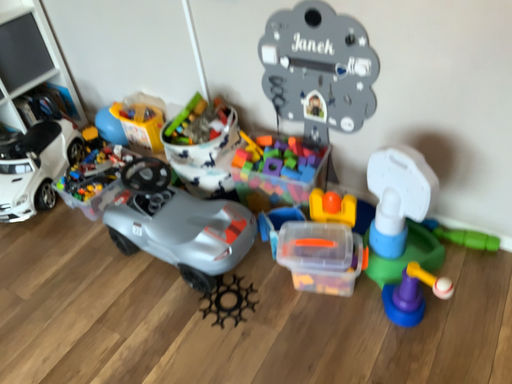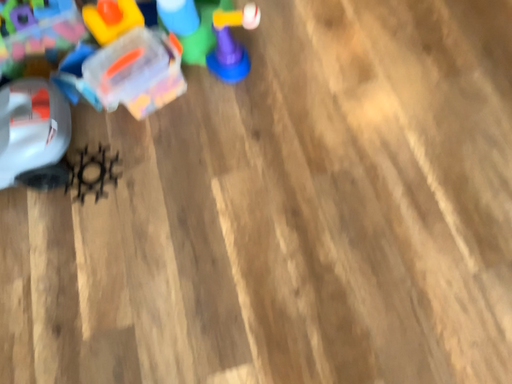
Question: Which way did the camera rotate in the video?

Choices:
 (A) rotated downward
 (B) rotated upward

Answer: (A)